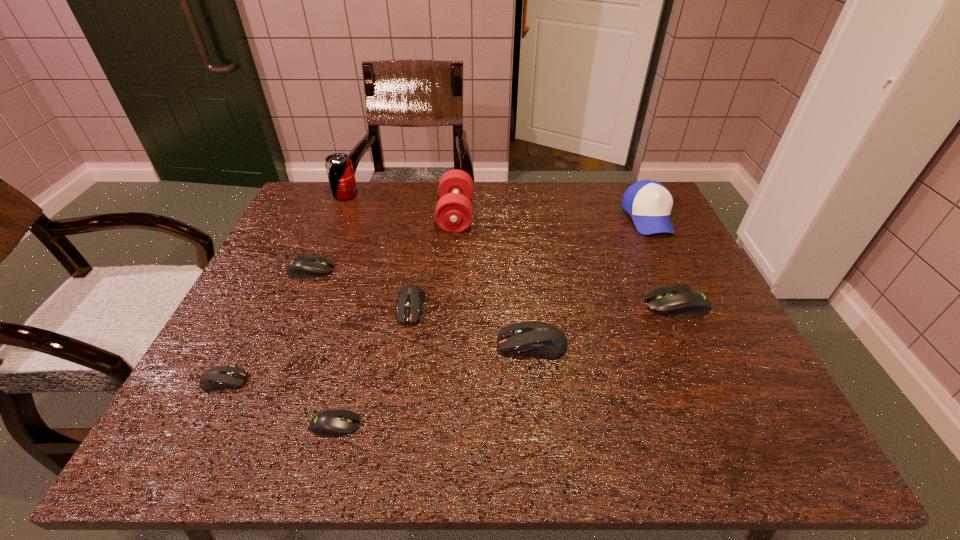
In order to click on the second closest gray computer mouse to the second nearest gray computer mouse in this screenshot , I will do `click(306, 266)`.

Locate an element on the screen. blank area in the image that satisfies the following two spatial constraints: 1. on the front-facing side of the baseball cap; 2. on the wheel side of the biggest gray computer mouse is located at coordinates pos(691,305).